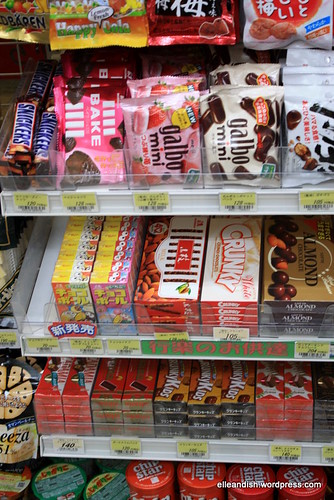
Locate an element on the screen. plastic grocery shelving is located at coordinates (134, 329), (153, 433), (199, 178).